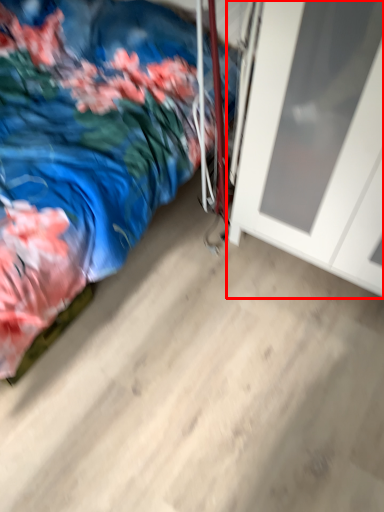
Question: From the image's perspective, what is the correct spatial positioning of door (annotated by the red box) in reference to bed?

Choices:
 (A) below
 (B) above

Answer: (A)